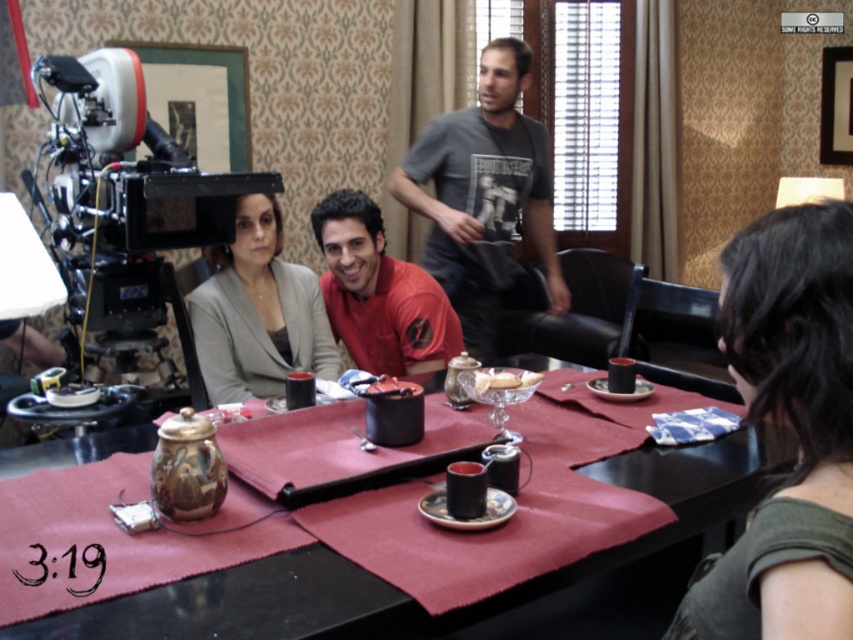
Question: Which point appears closest to the camera in this image?

Choices:
 (A) (468, 196)
 (B) (405, 314)
 (C) (242, 609)
 (D) (482, 392)

Answer: (C)

Question: Does red matte shirt at center have a lesser width compared to white porcelain plate at center?

Choices:
 (A) no
 (B) yes

Answer: (A)

Question: Estimate the real-world distances between objects in this image. Which object is closer to the matte gray blazer at center?

Choices:
 (A) maroon fabric table at center
 (B) white porcelain plate at center
 (C) green fabric shirt at right
 (D) red matte shirt at center

Answer: (D)

Question: Is gray printed t-shirt at upper center closer to camera compared to red matte shirt at center?

Choices:
 (A) yes
 (B) no

Answer: (B)

Question: Is gray printed t-shirt at upper center positioned before matte gray blazer at center?

Choices:
 (A) no
 (B) yes

Answer: (A)

Question: Which is nearer to the matte gray blazer at center?

Choices:
 (A) maroon fabric table at center
 (B) green fabric shirt at right

Answer: (A)